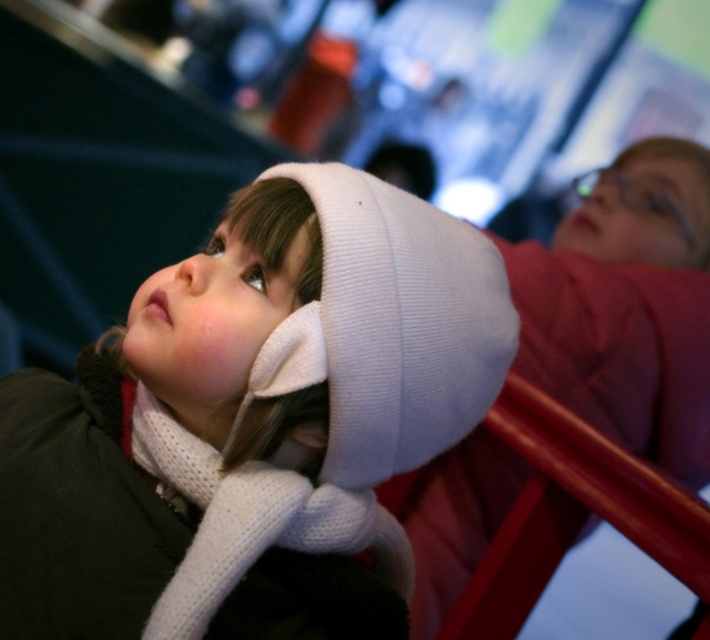
Question: Estimate the real-world distances between objects in this image. Which object is closer to the white knitted scarf at lower left?

Choices:
 (A) white knitted hat at upper left
 (B) white knit hat at upper right

Answer: (A)

Question: Does white knitted hat at upper left appear under white knitted scarf at lower left?

Choices:
 (A) no
 (B) yes

Answer: (A)

Question: Which of the following is the farthest from the observer?

Choices:
 (A) white knitted hat at upper left
 (B) white knit hat at upper right

Answer: (B)

Question: Is white knit hat at upper right bigger than white knitted scarf at lower left?

Choices:
 (A) no
 (B) yes

Answer: (B)

Question: Which of the following is the closest to the observer?

Choices:
 (A) (180, 451)
 (B) (89, 429)
 (C) (469, 486)

Answer: (A)

Question: Is white knit hat at upper right above white knitted scarf at lower left?

Choices:
 (A) yes
 (B) no

Answer: (A)